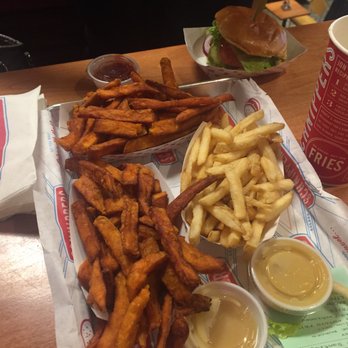
Locate an element on the screen. This screenshot has height=348, width=348. napkins is located at coordinates (22, 159).